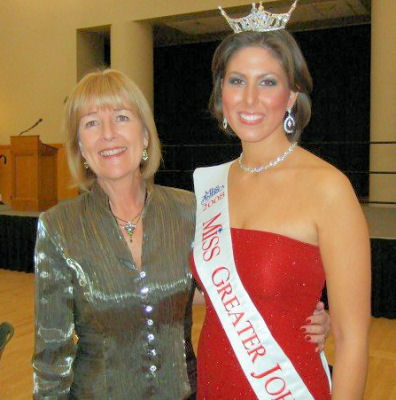
Where is `sash`? The height and width of the screenshot is (400, 396). sash is located at coordinates (261, 370).